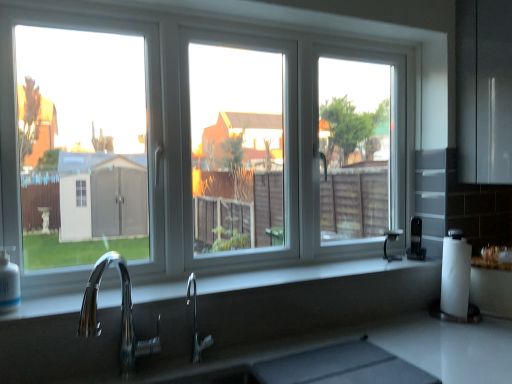
Question: Considering the relative positions of black plastic coffee maker at right and chrome/metallic faucet at lower left, the second tap from the right, in the image provided, is black plastic coffee maker at right in front of chrome/metallic faucet at lower left, the second tap from the right,?

Choices:
 (A) no
 (B) yes

Answer: (A)

Question: Is black plastic coffee maker at right to the left of chrome/metallic faucet at lower left, which appears as the 1th tap when viewed from the front, from the viewer's perspective?

Choices:
 (A) no
 (B) yes

Answer: (A)

Question: Is black plastic coffee maker at right outside chrome/metallic faucet at lower left, the second tap from the right?

Choices:
 (A) yes
 (B) no

Answer: (A)

Question: Is black plastic coffee maker at right facing away from chrome/metallic faucet at lower left, acting as the second tap starting from the back?

Choices:
 (A) yes
 (B) no

Answer: (B)

Question: Is black plastic coffee maker at right to the right of chrome/metallic faucet at lower left, the second tap from the right, from the viewer's perspective?

Choices:
 (A) yes
 (B) no

Answer: (A)

Question: Does point (132, 316) appear closer or farther from the camera than point (189, 294)?

Choices:
 (A) closer
 (B) farther

Answer: (A)

Question: From the image's perspective, is chrome/metallic faucet at lower left, which appears as the 1th tap when viewed from the front, above or below polished chrome faucet at center, placed as the 2th tap when sorted from front to back?

Choices:
 (A) above
 (B) below

Answer: (A)

Question: Visually, is chrome/metallic faucet at lower left, acting as the first tap starting from the left, positioned to the left or to the right of polished chrome faucet at center, placed as the 2th tap when sorted from front to back?

Choices:
 (A) right
 (B) left

Answer: (B)

Question: In terms of height, does chrome/metallic faucet at lower left, acting as the second tap starting from the back, look taller or shorter compared to polished chrome faucet at center, the first tap viewed from the right?

Choices:
 (A) tall
 (B) short

Answer: (A)

Question: Considering the relative positions of smooth gray countertop at center and polished chrome faucet at center, placed as the 2th tap when sorted from front to back, in the image provided, is smooth gray countertop at center to the left or to the right of polished chrome faucet at center, placed as the 2th tap when sorted from front to back,?

Choices:
 (A) right
 (B) left

Answer: (A)

Question: Is smooth gray countertop at center bigger or smaller than polished chrome faucet at center, which is counted as the 2th tap, starting from the left?

Choices:
 (A) small
 (B) big

Answer: (B)

Question: Relative to polished chrome faucet at center, which is counted as the 2th tap, starting from the left, is smooth gray countertop at center in front or behind?

Choices:
 (A) front
 (B) behind

Answer: (A)

Question: Is smooth gray countertop at center wider or thinner than polished chrome faucet at center, which is counted as the 2th tap, starting from the left?

Choices:
 (A) wide
 (B) thin

Answer: (A)

Question: From a real-world perspective, relative to white plastic window at center, is smooth gray countertop at center vertically above or below?

Choices:
 (A) below
 (B) above

Answer: (A)

Question: From the image's perspective, is smooth gray countertop at center positioned above or below white plastic window at center?

Choices:
 (A) above
 (B) below

Answer: (B)